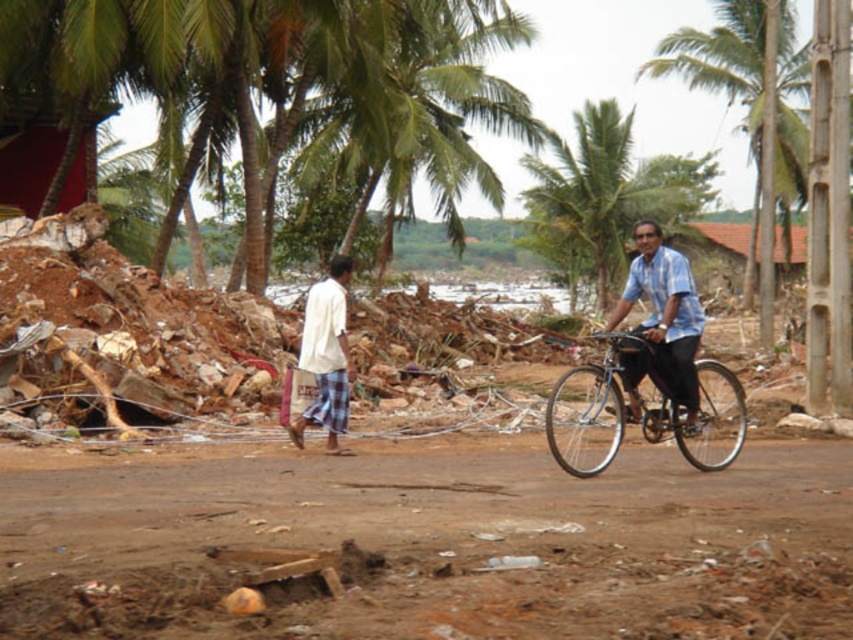
Question: Can you confirm if green leafy palm tree at upper right is wider than metallic blue bicycle at right?

Choices:
 (A) no
 (B) yes

Answer: (B)

Question: Is metallic blue bicycle at right to the right of white cotton shirt at center from the viewer's perspective?

Choices:
 (A) yes
 (B) no

Answer: (A)

Question: Can you confirm if green leafy palm tree at upper right is positioned to the right of metallic blue bicycle at right?

Choices:
 (A) yes
 (B) no

Answer: (A)

Question: Which of these objects is positioned farthest from the green leafy palm tree at center?

Choices:
 (A) white cotton shirt at center
 (B) green leafy palm tree at upper right
 (C) blue shirt at center

Answer: (C)

Question: Which object is the closest to the brown dirt field at center?

Choices:
 (A) blue shirt at center
 (B) green leafy palm tree at center
 (C) metallic blue bicycle at right

Answer: (A)

Question: Which point is farther to the camera?

Choices:
 (A) green leafy palm tree at upper right
 (B) white cotton shirt at center
 (C) blue shirt at center
 (D) metallic blue bicycle at right

Answer: (A)